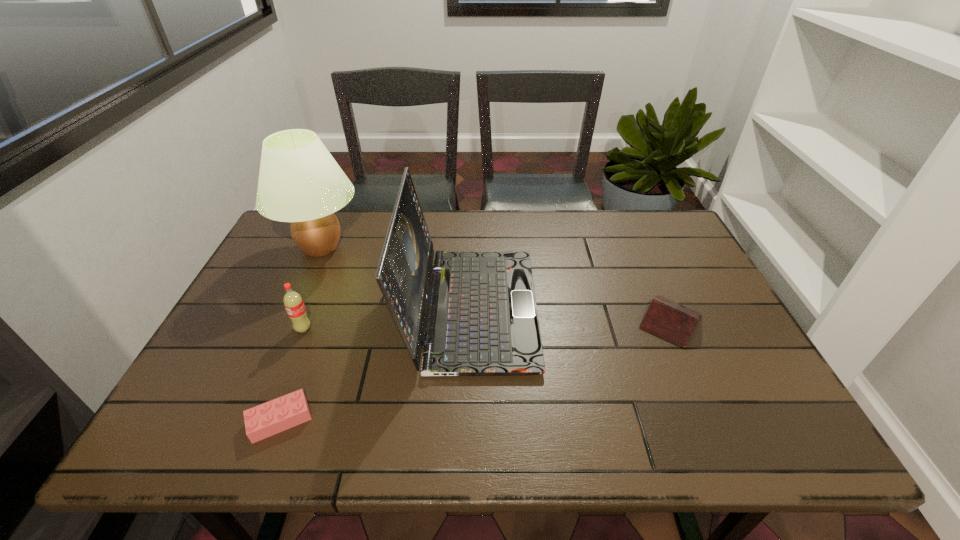
Identify the location of free space located on the front of the third tallest object. (286, 372).

Find the location of a particular element. Image resolution: width=960 pixels, height=540 pixels. vacant space located on the back of the fourth tallest object is located at coordinates (624, 215).

This screenshot has height=540, width=960. I want to click on vacant region located on the back of the Lego, so click(x=317, y=323).

This screenshot has width=960, height=540. Identify the location of object located at the far edge. (300, 182).

Locate an element on the screen. The width and height of the screenshot is (960, 540). object that is positioned at the near edge is located at coordinates (262, 421).

Find the location of a particular element. object positioned at the left edge is located at coordinates (300, 182).

Find the location of a particular element. The image size is (960, 540). object present at the right edge is located at coordinates (667, 319).

Where is `object at the far left corner`? This screenshot has height=540, width=960. object at the far left corner is located at coordinates (300, 182).

You are a GUI agent. You are given a task and a screenshot of the screen. Output one action in this format:
    pyautogui.click(x=<x>, y=<y>)
    Task: Click on the vacant space at the far edge
    Image resolution: width=960 pixels, height=540 pixels.
    Given the screenshot: What is the action you would take?
    pyautogui.click(x=479, y=230)

Find the location of `free location at the near edge of the desktop`. free location at the near edge of the desktop is located at coordinates tap(614, 443).